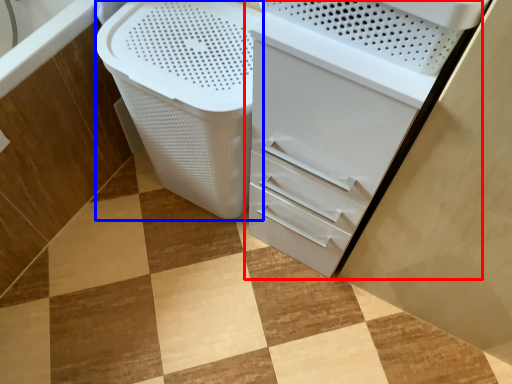
Question: Which point is closer to the camera, file cabinet (highlighted by a red box) or laundry basket (highlighted by a blue box)?

Choices:
 (A) file cabinet
 (B) laundry basket

Answer: (A)